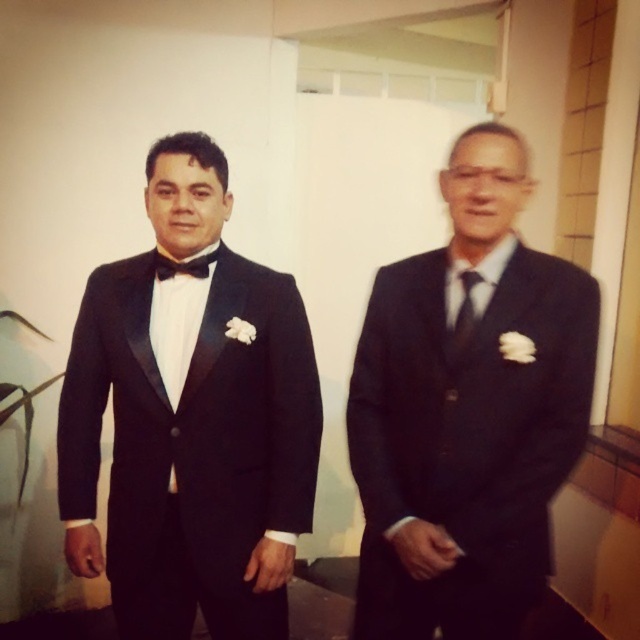
Image resolution: width=640 pixels, height=640 pixels. Describe the element at coordinates (189, 419) in the screenshot. I see `matte black tuxedo at left` at that location.

At what (x,y) coordinates should I click in order to perform the action: click on matte black tuxedo at left. Please return your answer as a coordinate pair (x, y). This screenshot has height=640, width=640. Looking at the image, I should click on tap(189, 419).

Who is more distant from viewer, (236, 326) or (476, 417)?

Positioned behind is point (236, 326).

Who is shorter, matte black tuxedo at left or matte black suit at center?

Standing shorter between the two is matte black suit at center.

Does point (209, 579) lie behind point (540, 362)?

That is True.

This screenshot has height=640, width=640. Identify the location of matte black tuxedo at left. (189, 419).

Is matte black tuxedo at left below black satin bow tie at center?

Yes, matte black tuxedo at left is below black satin bow tie at center.

Is matte black tuxedo at left above black satin bow tie at center?

Actually, matte black tuxedo at left is below black satin bow tie at center.

Identify the location of matte black tuxedo at left. This screenshot has width=640, height=640. (189, 419).